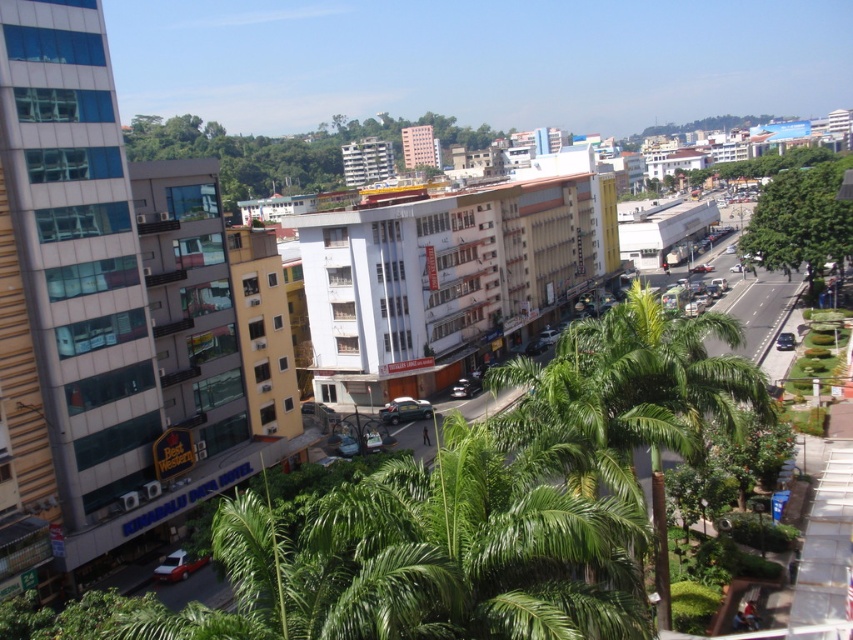
Question: Can you confirm if green leafy tree at center is thinner than metallic green car at center?

Choices:
 (A) no
 (B) yes

Answer: (A)

Question: Is the position of green leafy palm tree at center less distant than that of metallic red car at lower left?

Choices:
 (A) no
 (B) yes

Answer: (B)

Question: Which object is the farthest from the green leafy tree at center?

Choices:
 (A) green leafy tree at center-right
 (B) green leafy palm tree at center
 (C) metallic red car at lower left
 (D) metallic green car at center

Answer: (C)

Question: Which of the following is the closest to the observer?

Choices:
 (A) (175, 554)
 (B) (790, 195)
 (C) (618, 371)

Answer: (C)

Question: Estimate the real-world distances between objects in this image. Which object is farther from the green leafy palm tree at center?

Choices:
 (A) metallic green car at center
 (B) metallic red car at lower left
 (C) green leafy tree at center-right
 (D) green leafy tree at center

Answer: (D)

Question: Can you confirm if green leafy tree at center-right is smaller than metallic green car at center?

Choices:
 (A) no
 (B) yes

Answer: (A)